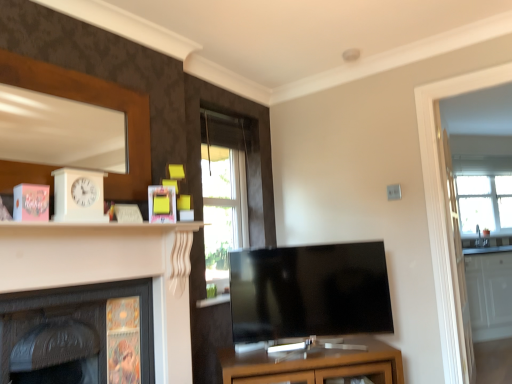
In order to click on blank area beneath black glossy tv at center (from a real-world perspective) in this screenshot , I will do `click(301, 355)`.